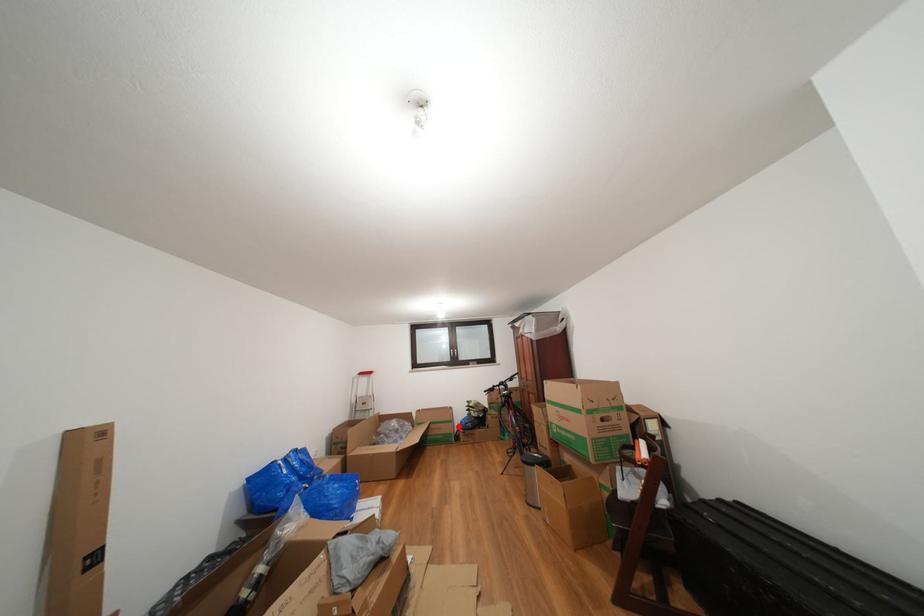
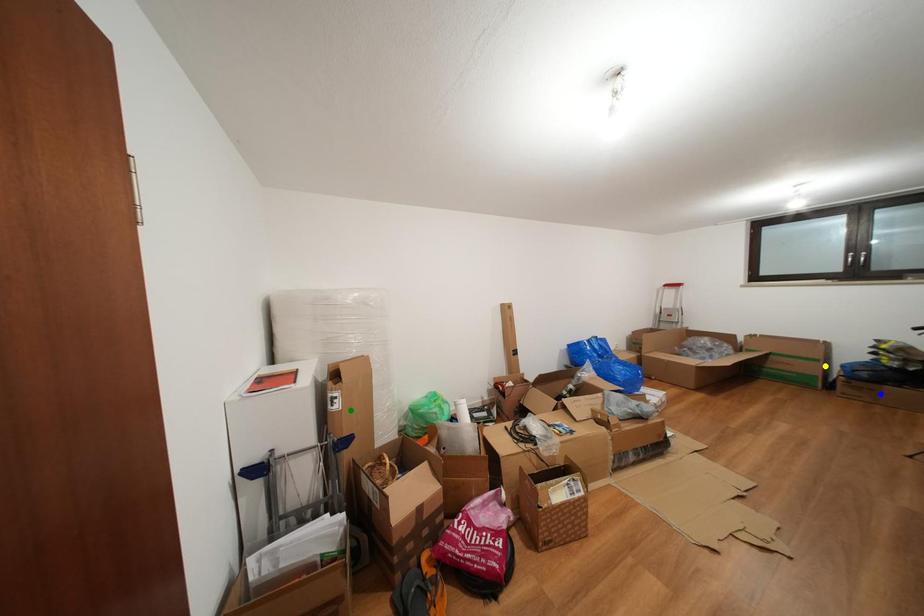
Question: I am providing you with two images of the same scene from different viewpoints. A red point is marked on the first image. You are given multiple points on the second image. Which spot in image 2 lines up with the point in image 1?

Choices:
 (A) green point
 (B) yellow point
 (C) blue point

Answer: (B)